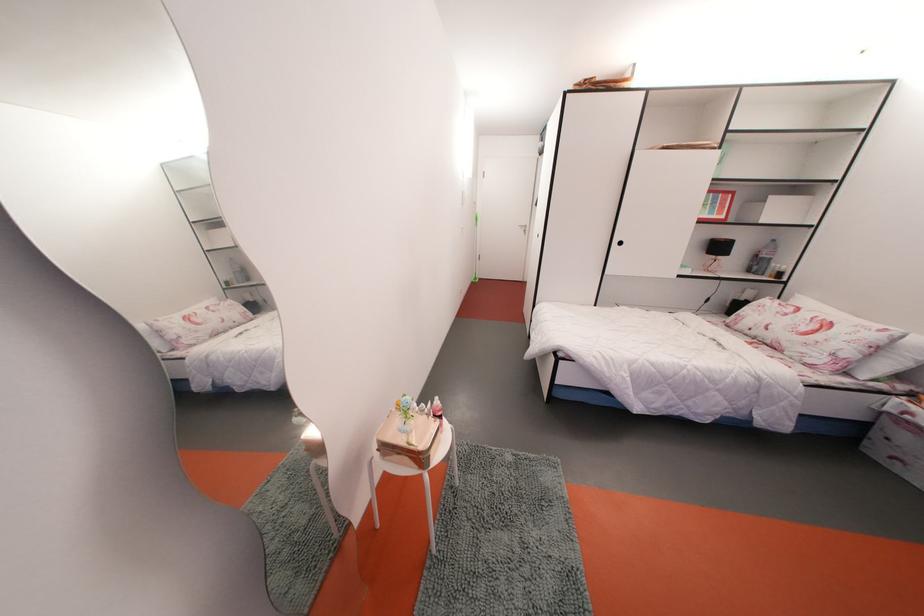
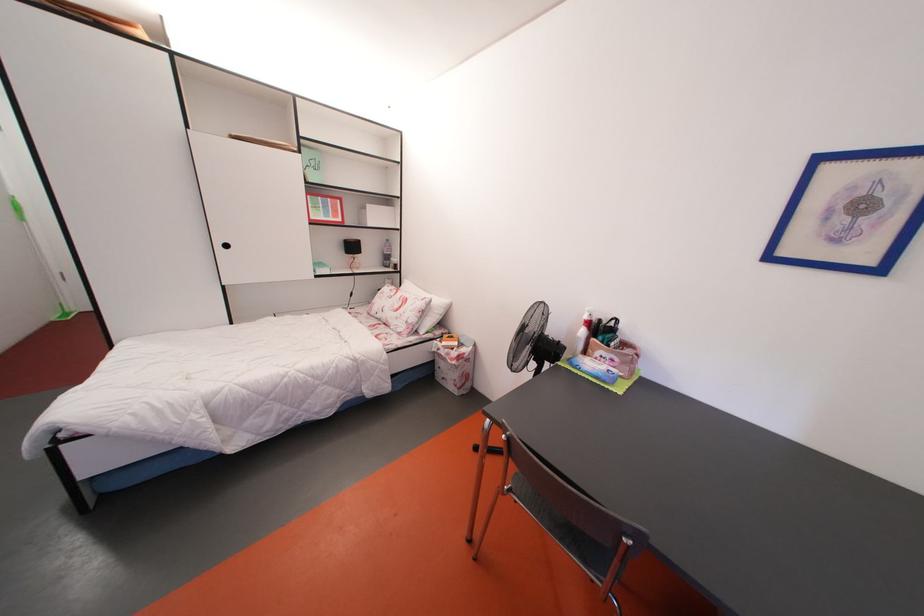
Locate, in the second image, the point that corresponds to point 849,361 in the first image.

(417, 326)